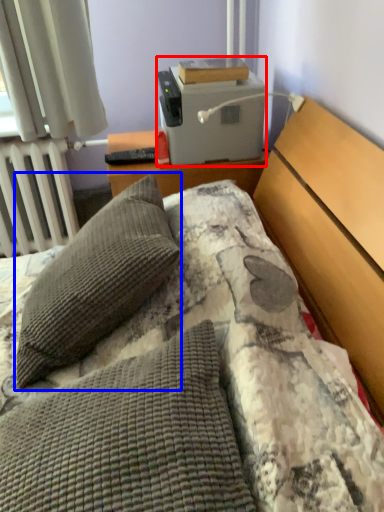
Question: Which of the following is the closest to the observer, printer (highlighted by a red box) or pillow (highlighted by a blue box)?

Choices:
 (A) printer
 (B) pillow

Answer: (B)